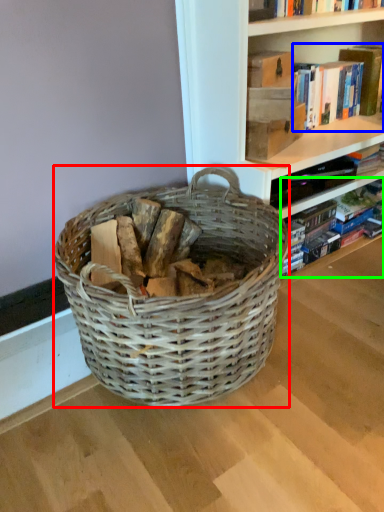
Question: Which object is positioned farthest from picnic basket (highlighted by a red box)? Select from book (highlighted by a blue box) and book (highlighted by a green box).

Choices:
 (A) book
 (B) book

Answer: (A)